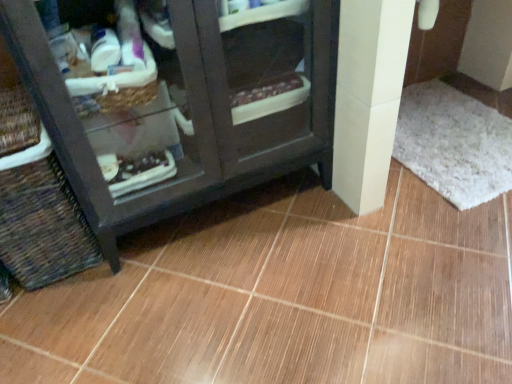
At what (x,y) coordinates should I click in order to perform the action: click on vacant space to the right of dark wood cabinet at lower left. Please return your answer as a coordinate pair (x, y). This screenshot has height=384, width=512. Looking at the image, I should click on (x=370, y=237).